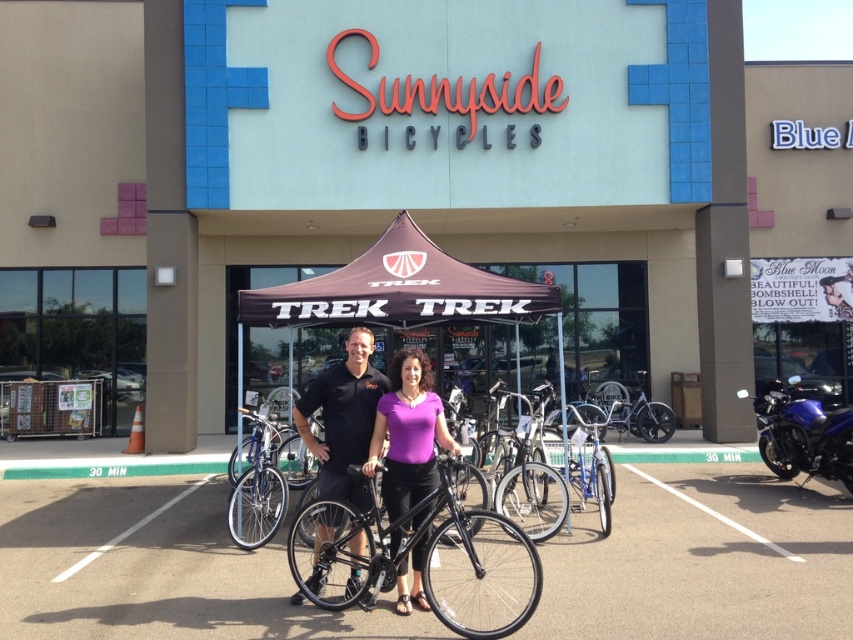
Does black matte bicycle at center have a greater width compared to silver metallic bicycle at center?

Yes.

Does black matte bicycle at center lie in front of silver metallic bicycle at center?

Yes.

What do you see at coordinates (430, 561) in the screenshot?
I see `black matte bicycle at center` at bounding box center [430, 561].

In order to click on black matte bicycle at center in this screenshot , I will do `click(430, 561)`.

Is smooth asphalt parking lot at center above purple matte shirt at center?

No, smooth asphalt parking lot at center is not above purple matte shirt at center.

Measure the distance from smooth asphalt parking lot at center to purple matte shirt at center.

smooth asphalt parking lot at center and purple matte shirt at center are 2.60 meters apart.

This screenshot has width=853, height=640. What do you see at coordinates (701, 560) in the screenshot?
I see `smooth asphalt parking lot at center` at bounding box center [701, 560].

This screenshot has width=853, height=640. I want to click on smooth asphalt parking lot at center, so click(x=701, y=560).

Who is more forward, (x=433, y=580) or (x=381, y=440)?

Point (x=381, y=440)

Is black matte bicycle at center below purple matte shirt at center?

Indeed, black matte bicycle at center is positioned under purple matte shirt at center.

You are a GUI agent. You are given a task and a screenshot of the screen. Output one action in this format:
    pyautogui.click(x=<x>, y=<y>)
    Task: Click on the black matte bicycle at center
    
    Given the screenshot: What is the action you would take?
    pyautogui.click(x=430, y=561)